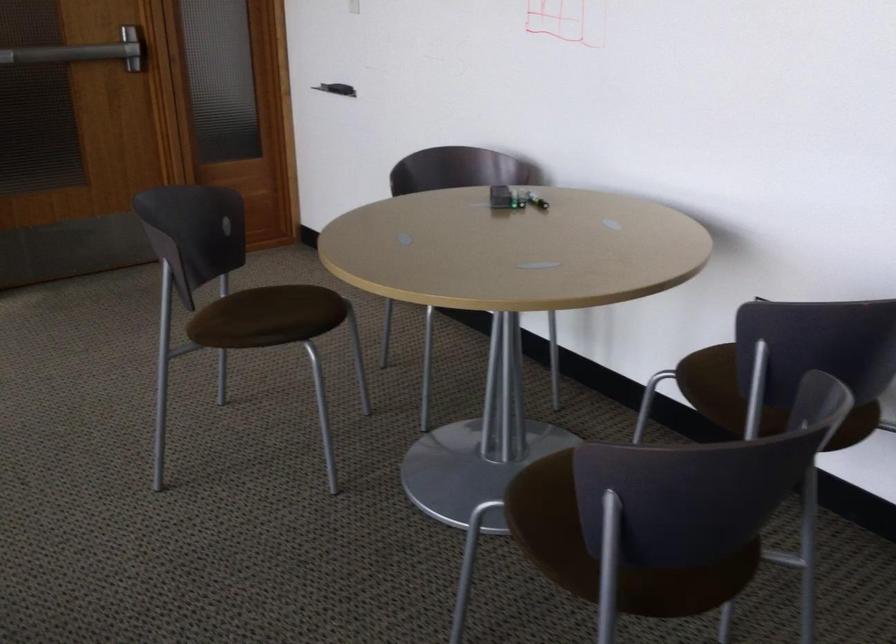
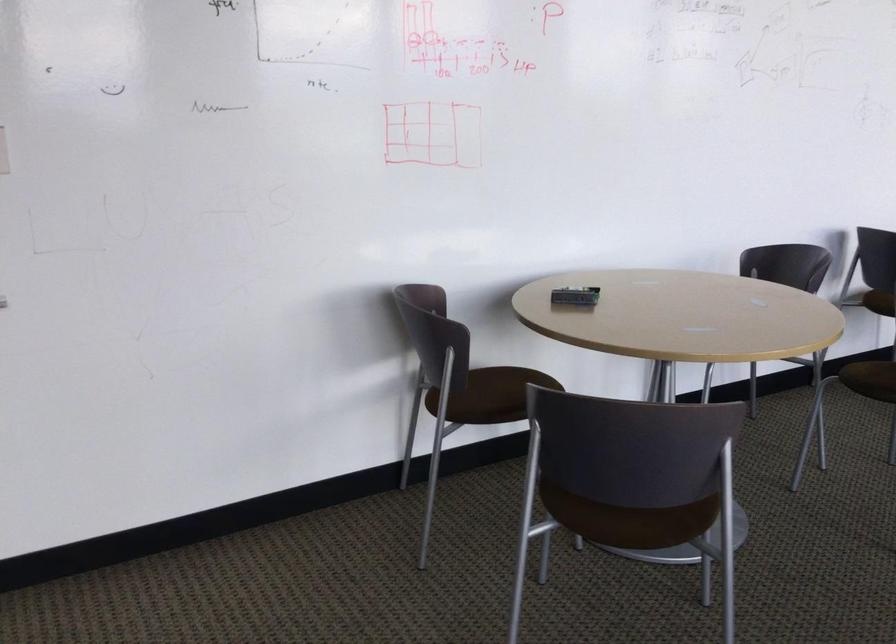
The point at (216, 303) is marked in the first image. Where is the corresponding point in the second image?

(633, 505)